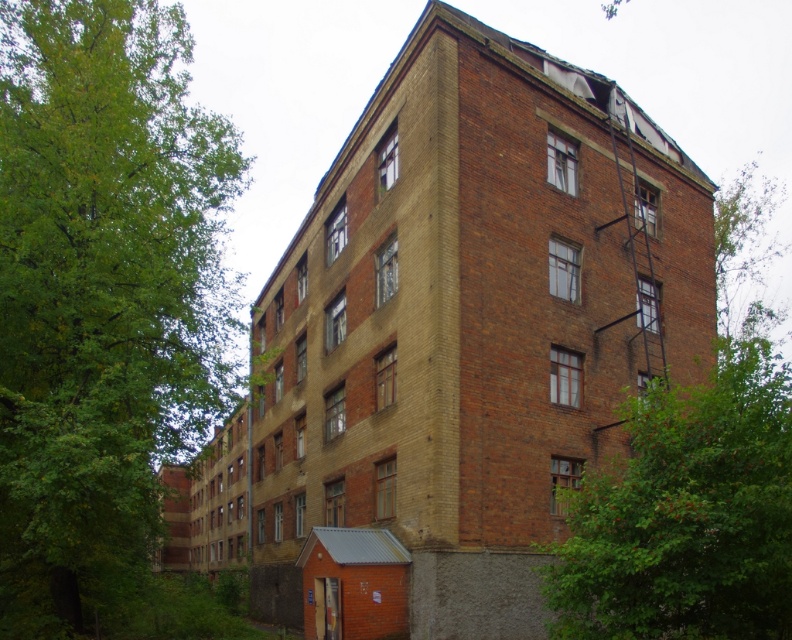
Is green leafy tree at left above green leafy tree at center?

Yes, green leafy tree at left is above green leafy tree at center.

The image size is (792, 640). Describe the element at coordinates (101, 296) in the screenshot. I see `green leafy tree at left` at that location.

Locate an element on the screen. This screenshot has width=792, height=640. green leafy tree at left is located at coordinates (101, 296).